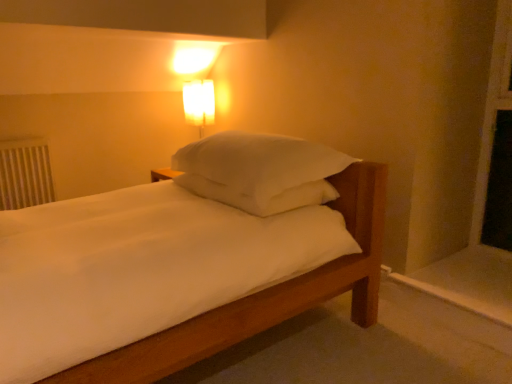
Locate an element on the screen. white plastic radiator at left is located at coordinates (25, 173).

Image resolution: width=512 pixels, height=384 pixels. Identify the location of white soft pillow at center. (259, 162).

The image size is (512, 384). Identify the location of white plastic radiator at left. (25, 173).

Is white plastic radiator at left with white painted wood at lower right?

No, white plastic radiator at left is not touching white painted wood at lower right.

Locate an element on the screen. radiator behind the white painted wood at lower right is located at coordinates (25, 173).

From the image's perspective, is white plastic radiator at left located above or below white painted wood at lower right?

white plastic radiator at left is situated higher than white painted wood at lower right in the image.

From a real-world perspective, who is located higher, white plastic radiator at left or white painted wood at lower right?

From a 3D spatial view, white plastic radiator at left is above.

From a real-world perspective, is white soft pillow at center positioned over white painted wood at lower right based on gravity?

Indeed, from a real-world perspective, white soft pillow at center stands above white painted wood at lower right.

Which of these two, white soft pillow at center or white painted wood at lower right, is smaller?

white painted wood at lower right.

Considering the relative sizes of white soft pillow at center and white painted wood at lower right in the image provided, is white soft pillow at center wider than white painted wood at lower right?

No.

Considering the relative sizes of white soft pillow at center and white painted wood at lower right in the image provided, is white soft pillow at center shorter than white painted wood at lower right?

No, white soft pillow at center is not shorter than white painted wood at lower right.

Is point (218, 312) closer to viewer compared to point (453, 301)?

That is True.

From a real-world perspective, is wooden bed frame at lower center beneath white painted wood at lower right?

Yes.

Considering the sizes of wooden bed frame at lower center and white painted wood at lower right in the image, is wooden bed frame at lower center taller or shorter than white painted wood at lower right?

In the image, wooden bed frame at lower center appears to be taller than white painted wood at lower right.

From a real-world perspective, which object stands above the other?

matte glass lampshade at upper center, from a real-world perspective.

Is matte glass lampshade at upper center outside of wooden bed frame at lower center?

Yes, matte glass lampshade at upper center is located beyond the bounds of wooden bed frame at lower center.

Is point (212, 99) more distant than point (309, 281)?

Yes, point (212, 99) is farther from viewer.

Considering the sizes of matte glass lampshade at upper center and wooden bed frame at lower center in the image, is matte glass lampshade at upper center bigger or smaller than wooden bed frame at lower center?

Clearly, matte glass lampshade at upper center is smaller in size than wooden bed frame at lower center.

Does point (258, 296) appear closer or farther from the camera than point (243, 176)?

Point (258, 296) is closer to the camera than point (243, 176).

How far apart are wooden bed frame at lower center and white soft pillow at center?

15.98 inches.

Does wooden bed frame at lower center appear on the left side of white soft pillow at center?

In fact, wooden bed frame at lower center is to the right of white soft pillow at center.

Is wooden bed frame at lower center positioned with its back to white soft pillow at center?

No, white soft pillow at center is not at the back of wooden bed frame at lower center.

From the image's perspective, is matte glass lampshade at upper center below white soft pillow at center?

No, from the image's perspective, matte glass lampshade at upper center is not below white soft pillow at center.

Does point (186, 119) lie behind point (272, 139)?

Yes.

Is matte glass lampshade at upper center looking in the opposite direction of white soft pillow at center?

No, matte glass lampshade at upper center is not facing away from white soft pillow at center.

Based on the photo, would you say matte glass lampshade at upper center is to the left or to the right of white soft pillow at center in the picture?

matte glass lampshade at upper center is positioned on white soft pillow at center's left side.

Is white painted wood at lower right to the left of white plastic radiator at left from the viewer's perspective?

No, white painted wood at lower right is not to the left of white plastic radiator at left.

Who is bigger, white painted wood at lower right or white plastic radiator at left?

Bigger between the two is white painted wood at lower right.

From the image's perspective, which is below, white painted wood at lower right or white plastic radiator at left?

white painted wood at lower right.

From the picture: Is white painted wood at lower right turned away from white plastic radiator at left?

white painted wood at lower right is not turned away from white plastic radiator at left.

The height and width of the screenshot is (384, 512). Find the location of `radiator lying behind the white painted wood at lower right`. radiator lying behind the white painted wood at lower right is located at coordinates tap(25, 173).

Find the location of `pillow above the white painted wood at lower right (from the image's perspective)`. pillow above the white painted wood at lower right (from the image's perspective) is located at coordinates (259, 162).

From the image, which object appears to be farther from white painted wood at lower right, matte glass lampshade at upper center or white plastic radiator at left?

white plastic radiator at left lies further to white painted wood at lower right than the other object.

Considering their positions, is white painted wood at lower right positioned further to white plastic radiator at left than white soft pillow at center?

white painted wood at lower right is further to white plastic radiator at left.

Based on their spatial positions, is white plastic radiator at left or matte glass lampshade at upper center closer to white painted wood at lower right?

matte glass lampshade at upper center is closer to white painted wood at lower right.

Estimate the real-world distances between objects in this image. Which object is further from white plastic radiator at left, matte glass lampshade at upper center or wooden bed frame at lower center?

wooden bed frame at lower center is positioned further to the anchor white plastic radiator at left.

Which object lies nearer to the anchor point white soft pillow at center, wooden bed frame at lower center or white painted wood at lower right?

wooden bed frame at lower center is positioned closer to the anchor white soft pillow at center.

From the image, which object appears to be farther from white plastic radiator at left, white painted wood at lower right or wooden bed frame at lower center?

Based on the image, white painted wood at lower right appears to be further to white plastic radiator at left.

When comparing their distances from white soft pillow at center, does matte glass lampshade at upper center or white painted wood at lower right seem further?

matte glass lampshade at upper center.

From the image, which object appears to be nearer to white plastic radiator at left, matte glass lampshade at upper center or white painted wood at lower right?

Based on the image, matte glass lampshade at upper center appears to be nearer to white plastic radiator at left.

You are a GUI agent. You are given a task and a screenshot of the screen. Output one action in this format:
    pyautogui.click(x=<x>, y=<y>)
    Task: Click on the pillow situated between white plastic radiator at left and white painted wood at lower right from left to right
    This screenshot has height=384, width=512.
    Given the screenshot: What is the action you would take?
    pyautogui.click(x=259, y=162)

Where is `pillow between white plastic radiator at left and wooden bed frame at lower center in the horizontal direction`? The image size is (512, 384). pillow between white plastic radiator at left and wooden bed frame at lower center in the horizontal direction is located at coordinates (259, 162).

Locate an element on the screen. The height and width of the screenshot is (384, 512). bed frame between white plastic radiator at left and white painted wood at lower right in the horizontal direction is located at coordinates (236, 323).

Identify the location of pillow located between matte glass lampshade at upper center and white painted wood at lower right in the left-right direction. This screenshot has width=512, height=384. (259, 162).